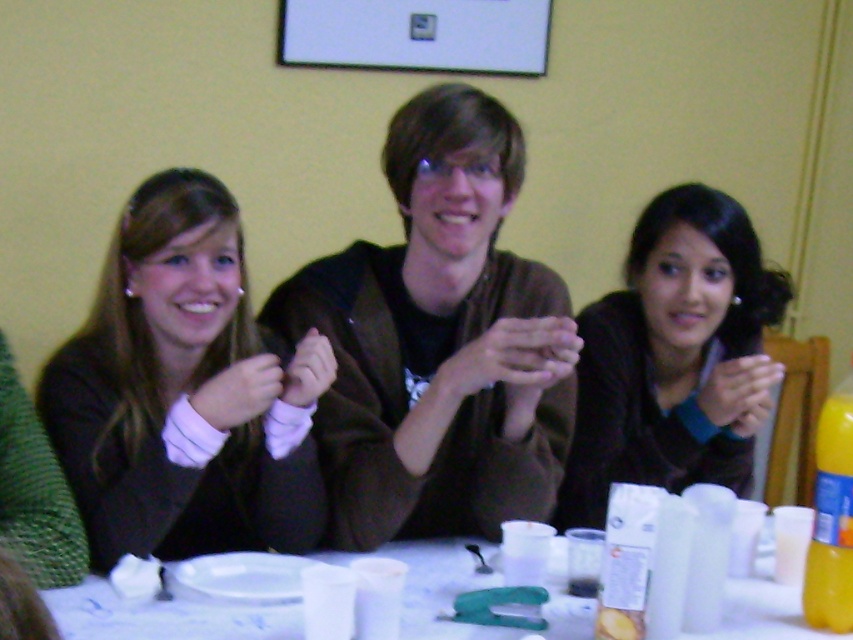
You are trying to decide which sweater to wear for a casual dinner. Both the matte black sweater at left and the dark brown sweater at center are options. Based on their lengths, which one would you choose if you prefer a shorter style?

The matte black sweater at left is shorter than the dark brown sweater at center, so you should choose the matte black sweater at left for a shorter style.

You are trying to decide which sweater to wear for a casual dinner. You see the matte black sweater at left and the dark brown sweater at center in the image. Which one is positioned to the left?

The matte black sweater at left is positioned to the left of the dark brown sweater at center.

You are trying to decide whether to place a large decorative bowl on the table. The bowl is the same size as the brown fuzzy sweater at center. Based on the scene, will the bowl fit on the white plastic table at lower center?

The brown fuzzy sweater at center has a larger size compared to white plastic table at lower center. Since the bowl is the same size as the sweater, it will not fit on the table.